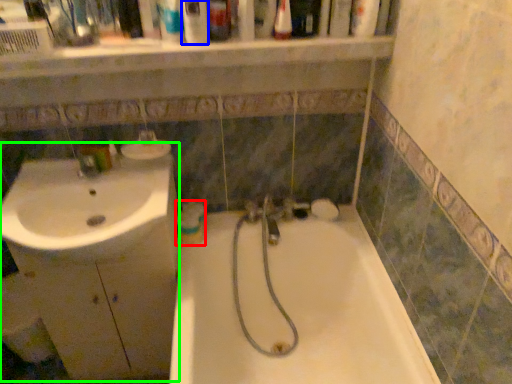
Question: Which object is positioned closest to mouthwash (highlighted by a red box)? Select from mouthwash (highlighted by a blue box) and porcelain (highlighted by a green box).

Choices:
 (A) mouthwash
 (B) porcelain

Answer: (B)